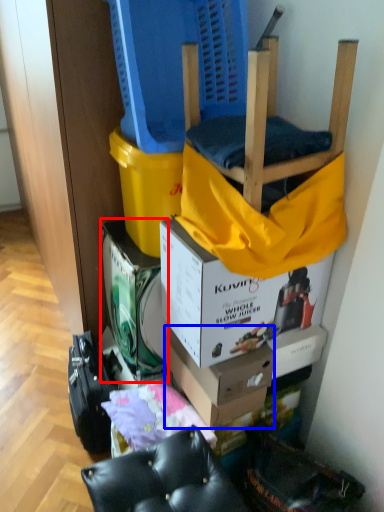
Question: Among these objects, which one is nearest to the camera, box (highlighted by a red box) or box (highlighted by a blue box)?

Choices:
 (A) box
 (B) box

Answer: (B)